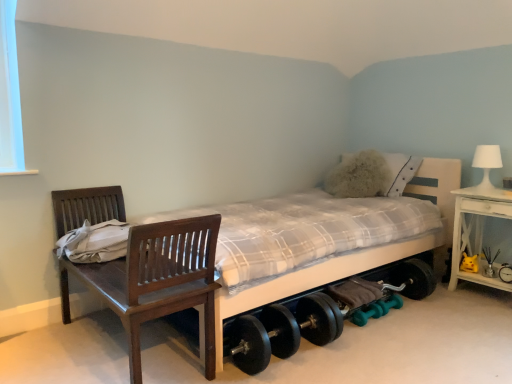
The width and height of the screenshot is (512, 384). In order to click on empty space that is to the right of teal rubber dumbbell at lower center, which is counted as the third dumbbell, starting from the right in this screenshot , I will do `click(398, 325)`.